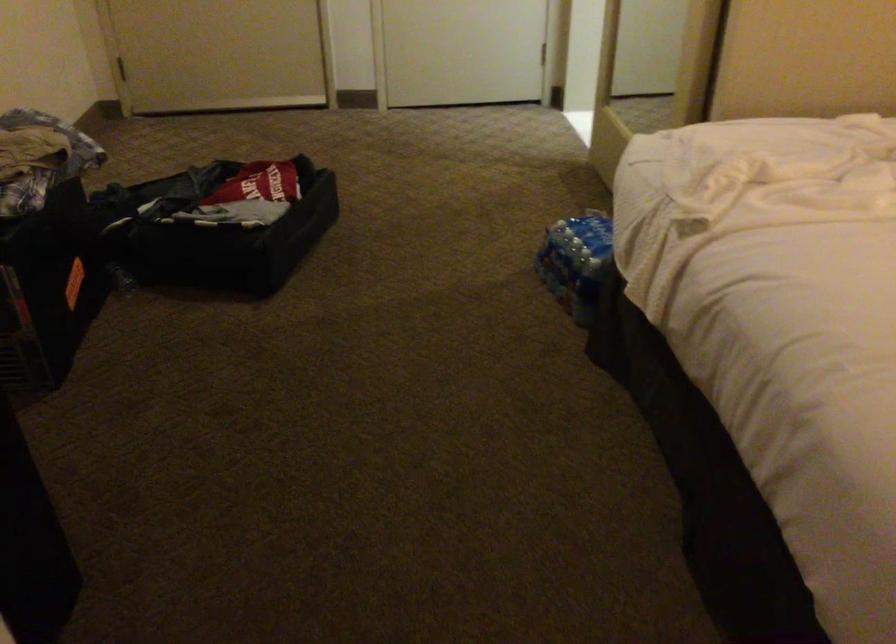
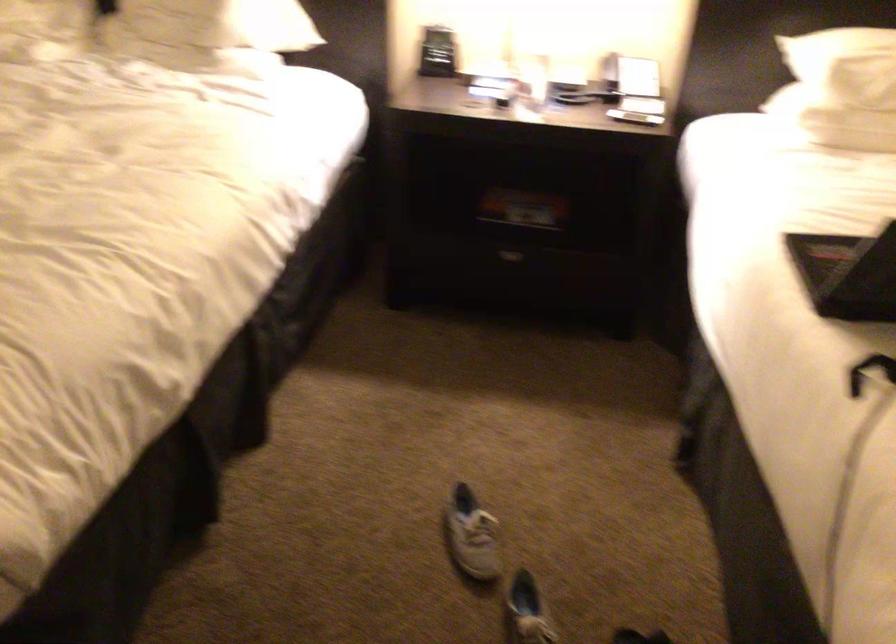
The first image is from the beginning of the video and the second image is from the end. How did the camera likely rotate when shooting the video?

The camera's rotation is toward right-down.